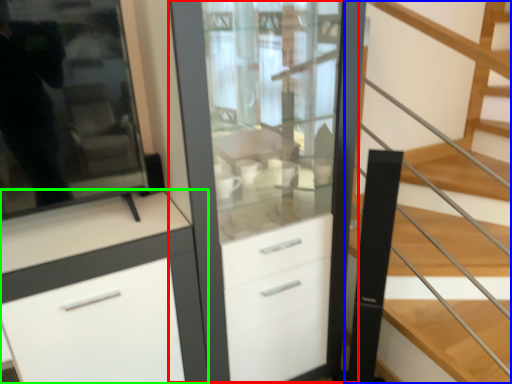
Question: Considering the real-world distances, which object is closest to dresser (highlighted by a red box)? stairs (highlighted by a blue box) or cabinetry (highlighted by a green box).

Choices:
 (A) stairs
 (B) cabinetry

Answer: (B)